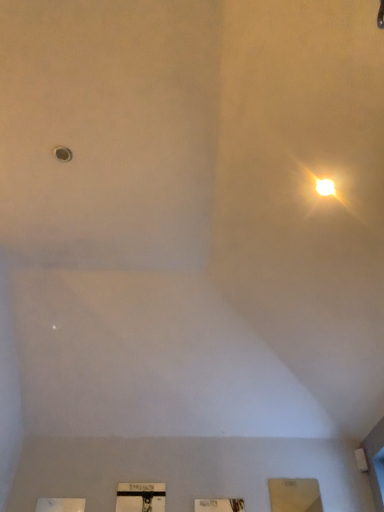
Describe the element at coordinates (325, 187) in the screenshot. The image size is (384, 512). I see `matte white droplight at upper right` at that location.

At what (x,y) coordinates should I click in order to perform the action: click on matte white droplight at upper right. Please return your answer as a coordinate pair (x, y). Looking at the image, I should click on (325, 187).

Locate an element on the screen. Image resolution: width=384 pixels, height=512 pixels. matte white droplight at upper right is located at coordinates (325, 187).